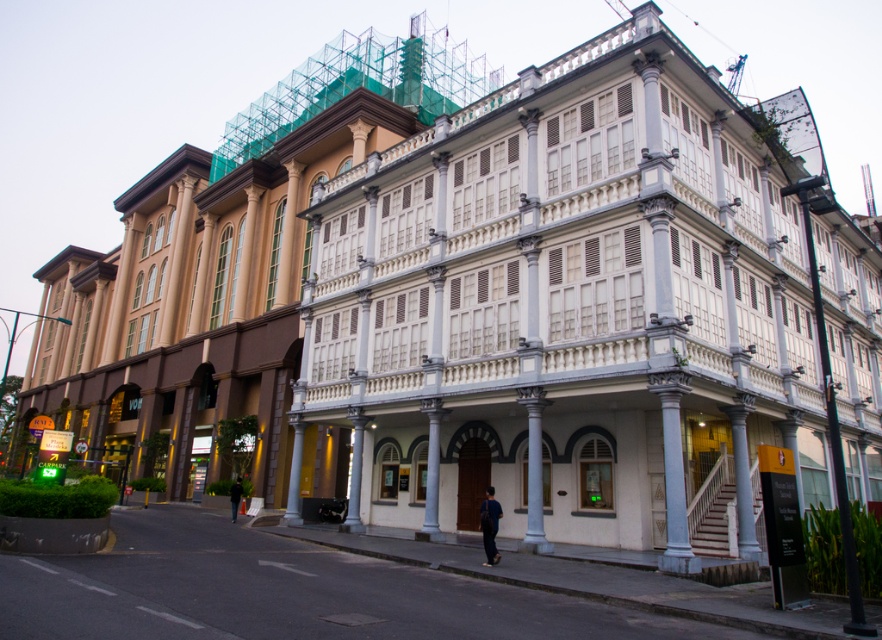
Question: Considering the relative positions of gray stone column at center and dark blue fabric at center in the image provided, where is gray stone column at center located with respect to dark blue fabric at center?

Choices:
 (A) above
 (B) below

Answer: (A)

Question: Which point appears farthest from the camera in this image?

Choices:
 (A) (491, 541)
 (B) (637, 349)
 (C) (238, 481)
 (D) (430, 460)

Answer: (C)

Question: Based on their relative distances, which object is nearer to the dark blue fabric at center?

Choices:
 (A) black fabric jacket at lower center
 (B) white stone column at center
 (C) white marble building at center
 (D) gray stone column at center

Answer: (D)

Question: Can you confirm if white stone column at center is bigger than dark blue fabric at center?

Choices:
 (A) yes
 (B) no

Answer: (A)

Question: Estimate the real-world distances between objects in this image. Which object is farther from the white marble building at center?

Choices:
 (A) black fabric jacket at lower center
 (B) gray stone column at center
 (C) dark blue fabric at center
 (D) white stone column at center

Answer: (A)

Question: From the image, what is the correct spatial relationship of gray stone column at center in relation to dark blue fabric at center?

Choices:
 (A) above
 (B) below

Answer: (A)